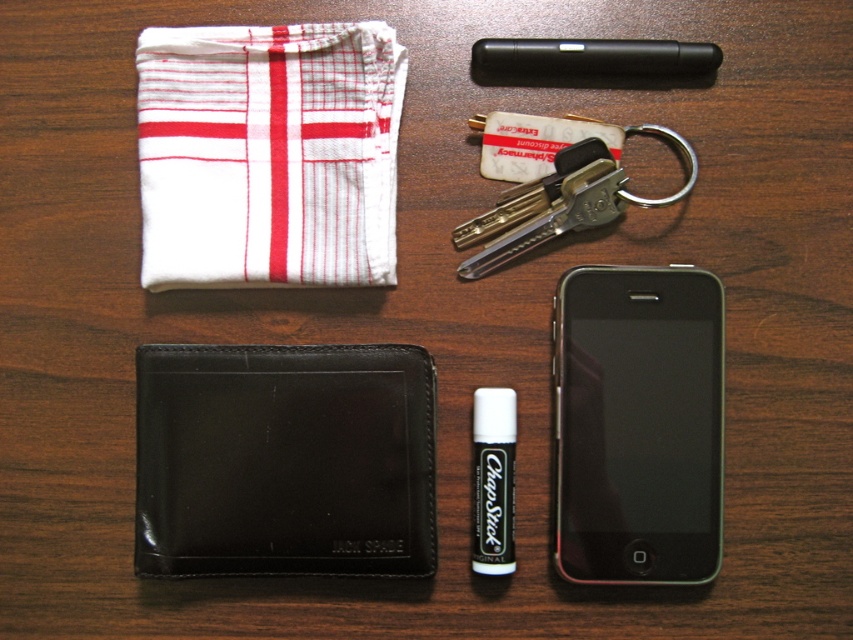
You are looking at the image of the wooden table with items. There are two points marked on the table surface. One is at coordinate point [163,120] and the other is at point [579,42]. Which of these two points is closer to you?

Point [163,120] is closer to you than point [579,42] because it is further to the camera according to the description.

You are organizing items on a wooden table. You have a white woven cloth at upper left and a black plastic pen at upper center. Which item is positioned lower on the table?

The white woven cloth at upper left is located below the black plastic pen at upper center, so it is positioned lower on the table.

In the scene shown: You need to place both the black leather wallet at lower left and the metallic silver keys at upper center into a small pouch that can only hold items smaller than the wallet. Which item can fit into the pouch?

The metallic silver keys at upper center can fit into the pouch since they are smaller than the black leather wallet at lower left.